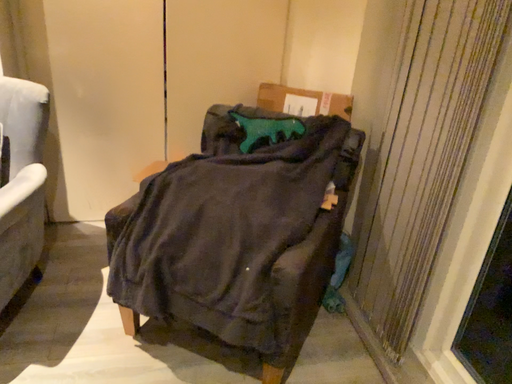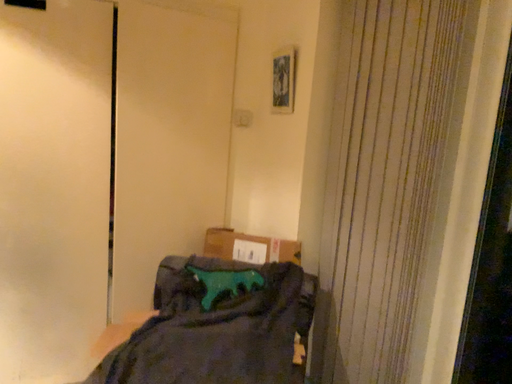
Question: Which way did the camera rotate in the video?

Choices:
 (A) rotated downward
 (B) rotated upward

Answer: (B)